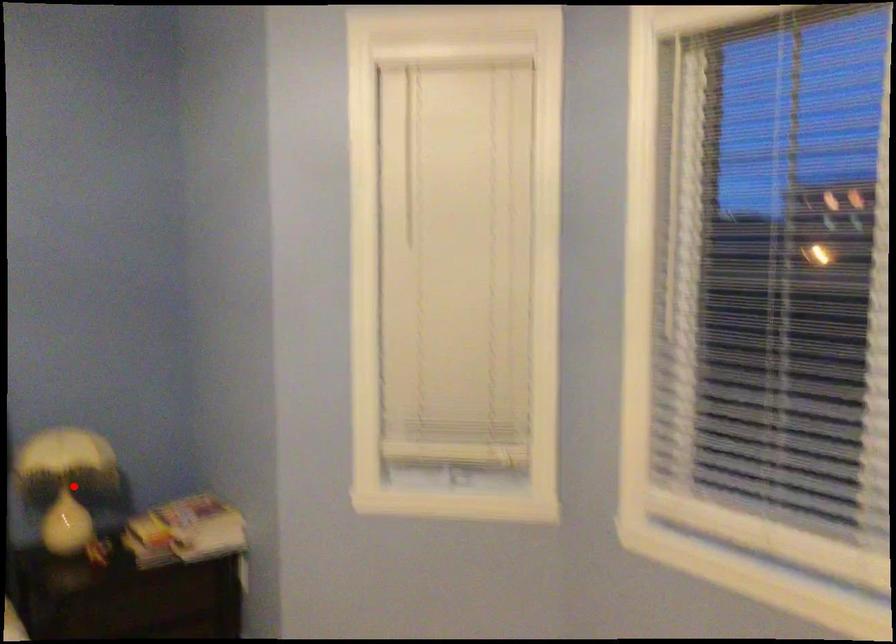
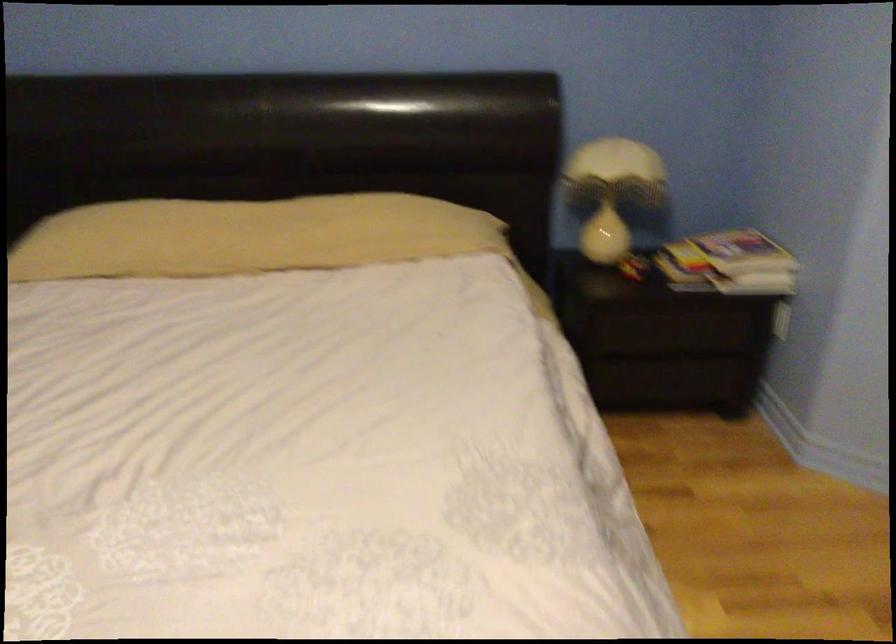
Where in the second image is the point corresponding to the highlighted location from the first image?

(613, 191)